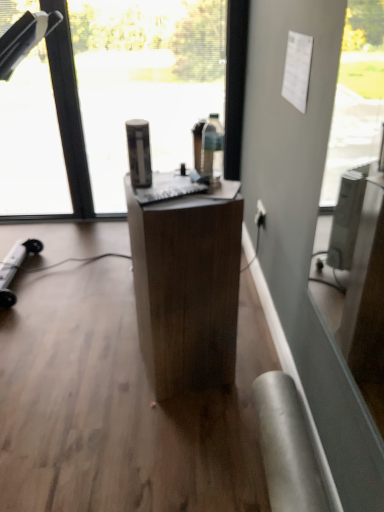
Question: Can you confirm if white plastic power outlet at lower right is positioned to the right of transparent glass window at center?

Choices:
 (A) yes
 (B) no

Answer: (A)

Question: Is there a large distance between white plastic power outlet at lower right and transparent glass window at center?

Choices:
 (A) yes
 (B) no

Answer: (A)

Question: Can you see white plastic power outlet at lower right touching transparent glass window at center?

Choices:
 (A) no
 (B) yes

Answer: (A)

Question: Is white plastic power outlet at lower right aimed at transparent glass window at center?

Choices:
 (A) yes
 (B) no

Answer: (A)

Question: Does white plastic power outlet at lower right have a lesser height compared to transparent glass window at center?

Choices:
 (A) no
 (B) yes

Answer: (B)

Question: From a real-world perspective, relative to white plastic power outlet at lower right, is transparent glass window at center vertically above or below?

Choices:
 (A) above
 (B) below

Answer: (A)

Question: In terms of size, does transparent glass window at center appear bigger or smaller than white plastic power outlet at lower right?

Choices:
 (A) small
 (B) big

Answer: (B)

Question: From the image's perspective, relative to white plastic power outlet at lower right, is transparent glass window at center above or below?

Choices:
 (A) above
 (B) below

Answer: (A)

Question: Considering their positions, is transparent glass window at center located in front of or behind white plastic power outlet at lower right?

Choices:
 (A) front
 (B) behind

Answer: (A)

Question: Looking at the image, does white plastic power outlet at lower right seem bigger or smaller compared to wooden desk at center?

Choices:
 (A) big
 (B) small

Answer: (B)

Question: From a real-world perspective, is white plastic power outlet at lower right physically located above or below wooden desk at center?

Choices:
 (A) below
 (B) above

Answer: (A)

Question: Is white plastic power outlet at lower right inside the boundaries of wooden desk at center, or outside?

Choices:
 (A) inside
 (B) outside

Answer: (B)

Question: Is white plastic power outlet at lower right taller or shorter than wooden desk at center?

Choices:
 (A) tall
 (B) short

Answer: (B)

Question: Is wooden desk at center in front of or behind white plastic power outlet at lower right in the image?

Choices:
 (A) behind
 (B) front

Answer: (B)

Question: Based on their positions, is wooden desk at center located to the left or right of white plastic power outlet at lower right?

Choices:
 (A) right
 (B) left

Answer: (B)